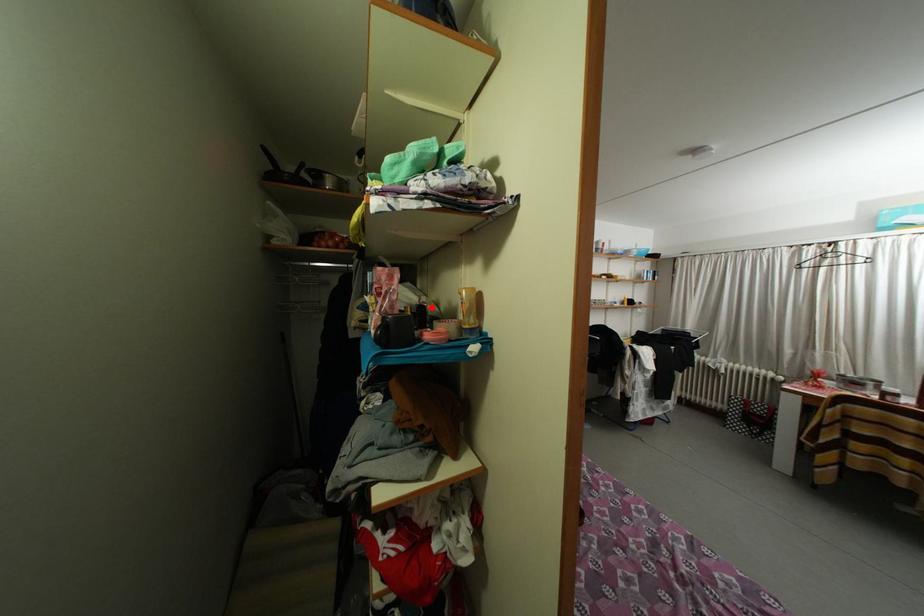
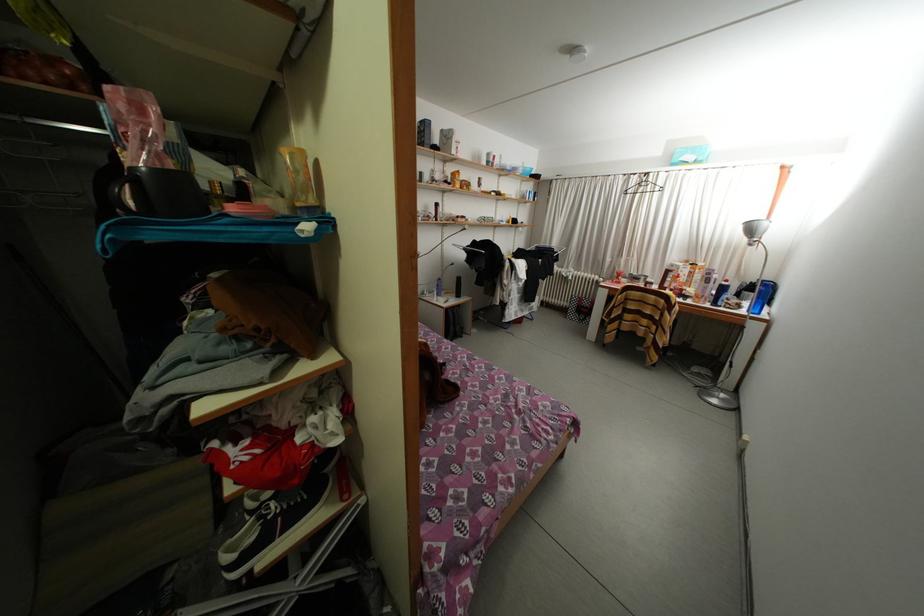
In the second image, find the point that corresponds to the highlighted location in the first image.

(250, 183)